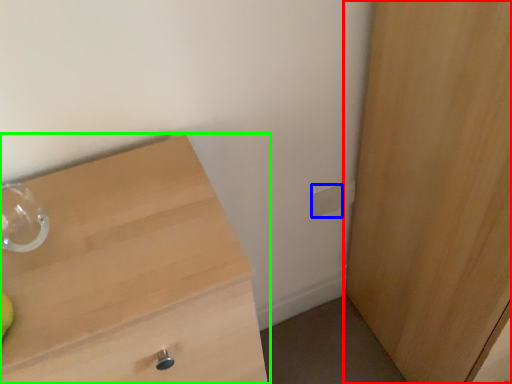
Question: Which object is positioned closest to cupboard (highlighted by a red box)? Select from electric outlet (highlighted by a blue box) and chest of drawers (highlighted by a green box).

Choices:
 (A) electric outlet
 (B) chest of drawers

Answer: (A)